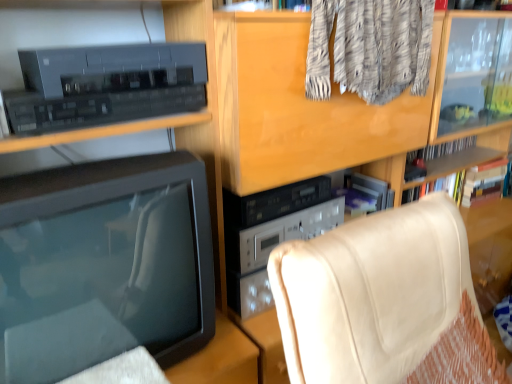
Describe the element at coordinates (104, 264) in the screenshot. This screenshot has width=512, height=384. I see `matte black television at left` at that location.

Identify the location of matte black television at left. (104, 264).

Locate an element on the screen. beige leather chair at lower right is located at coordinates (384, 301).

The image size is (512, 384). What do you see at coordinates (384, 301) in the screenshot?
I see `beige leather chair at lower right` at bounding box center [384, 301].

In order to click on matte black television at left in this screenshot , I will do `click(104, 264)`.

Which object is positioned more to the right, beige leather chair at lower right or matte black television at left?

Positioned to the right is beige leather chair at lower right.

Is the position of beige leather chair at lower right more distant than that of matte black television at left?

No, beige leather chair at lower right is in front of matte black television at left.

Is point (443, 295) more distant than point (158, 192)?

Yes, it is behind point (158, 192).

From the image's perspective, would you say beige leather chair at lower right is positioned over matte black television at left?

Incorrect, from the image's perspective, beige leather chair at lower right is lower than matte black television at left.

From a real-world perspective, who is located lower, beige leather chair at lower right or matte black television at left?

In real-world perspective, beige leather chair at lower right is lower.

Between beige leather chair at lower right and matte black television at left, which one has smaller width?

With smaller width is matte black television at left.

Who is taller, beige leather chair at lower right or matte black television at left?

beige leather chair at lower right.

Which of these two, beige leather chair at lower right or matte black television at left, is bigger?

beige leather chair at lower right.

Is beige leather chair at lower right outside of matte black television at left?

That's correct, beige leather chair at lower right is outside of matte black television at left.

Is the surface of beige leather chair at lower right in direct contact with matte black television at left?

No, beige leather chair at lower right is not in contact with matte black television at left.

Is beige leather chair at lower right positioned with its back to matte black television at left?

That's right, beige leather chair at lower right is facing away from matte black television at left.

What's the angular difference between beige leather chair at lower right and matte black television at left's facing directions?

The angular difference between beige leather chair at lower right and matte black television at left is 2.22 degrees.

Measure the distance from beige leather chair at lower right to matte black television at left.

beige leather chair at lower right is 16.77 inches from matte black television at left.

You are a GUI agent. You are given a task and a screenshot of the screen. Output one action in this format:
    pyautogui.click(x=<x>, y=<y>)
    Task: Click on the furniture on the right of matte black television at left
    The height and width of the screenshot is (384, 512).
    Given the screenshot: What is the action you would take?
    pyautogui.click(x=384, y=301)

Does matte black television at left appear on the right side of beige leather chair at lower right?

No.

Considering the positions of objects matte black television at left and beige leather chair at lower right in the image provided, who is in front, matte black television at left or beige leather chair at lower right?

beige leather chair at lower right is more forward.

Considering the positions of points (181, 254) and (310, 340), is point (181, 254) farther from camera compared to point (310, 340)?

Yes, point (181, 254) is farther from viewer.

From the image's perspective, is matte black television at left located above or below beige leather chair at lower right?

Clearly, from the image's perspective, matte black television at left is above beige leather chair at lower right.

From a real-world perspective, which object stands above the other?

matte black television at left is physically above.

Based on the photo, considering the relative sizes of matte black television at left and beige leather chair at lower right in the image provided, is matte black television at left wider than beige leather chair at lower right?

No.

Between matte black television at left and beige leather chair at lower right, which one has more height?

Standing taller between the two is beige leather chair at lower right.

From the picture: Considering the relative sizes of matte black television at left and beige leather chair at lower right in the image provided, is matte black television at left bigger than beige leather chair at lower right?

No.

Is matte black television at left inside the boundaries of beige leather chair at lower right, or outside?

matte black television at left is outside beige leather chair at lower right.

From the picture: Is matte black television at left placed right next to beige leather chair at lower right?

No, matte black television at left is not beside beige leather chair at lower right.

Is matte black television at left facing away from beige leather chair at lower right?

No, matte black television at left is not facing away from beige leather chair at lower right.

How different are the orientations of matte black television at left and beige leather chair at lower right in degrees?

2.22 degrees.

Image resolution: width=512 pixels, height=384 pixels. In order to click on television behind the beige leather chair at lower right in this screenshot , I will do `click(104, 264)`.

Identify the location of furniture that appears in front of the matte black television at left. (384, 301).

The image size is (512, 384). I want to click on television that is on the left side of beige leather chair at lower right, so click(x=104, y=264).